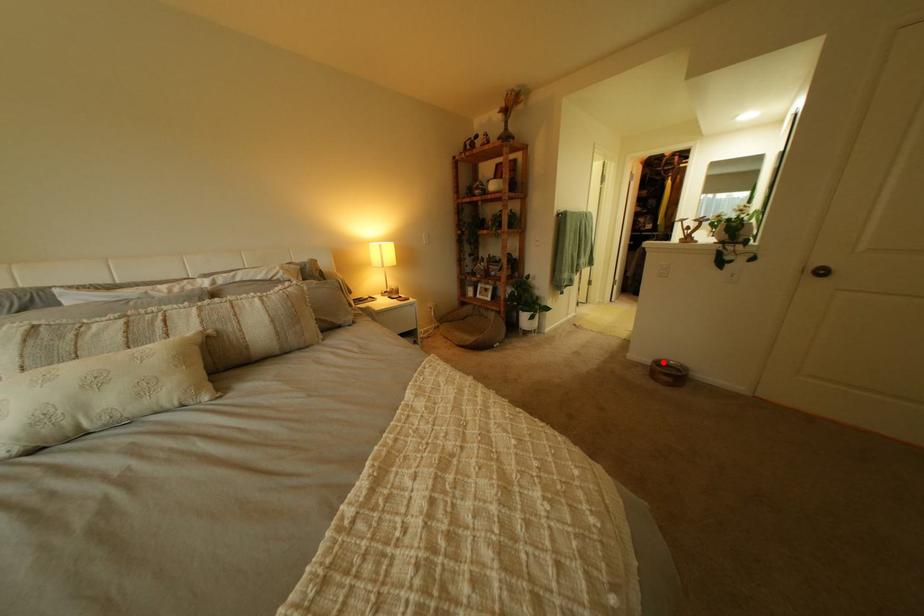
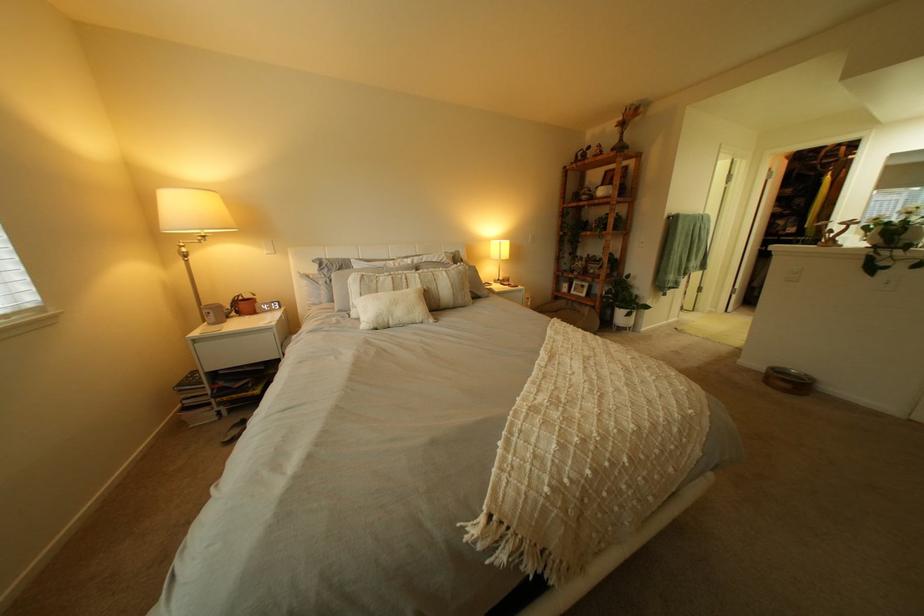
In the second image, find the point that corresponds to the highlighted location in the first image.

(779, 369)